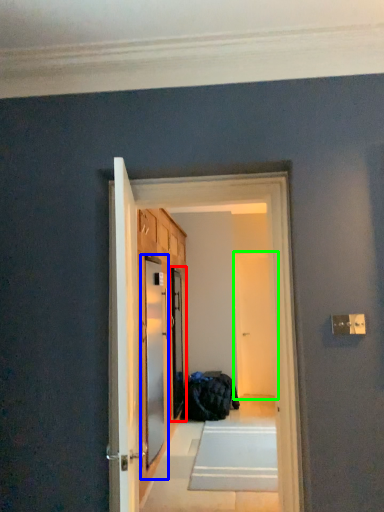
Question: Based on their relative distances, which object is nearer to screen door (highlighted by a red box)? Choose from screen door (highlighted by a blue box) and screen door (highlighted by a green box).

Choices:
 (A) screen door
 (B) screen door

Answer: (A)